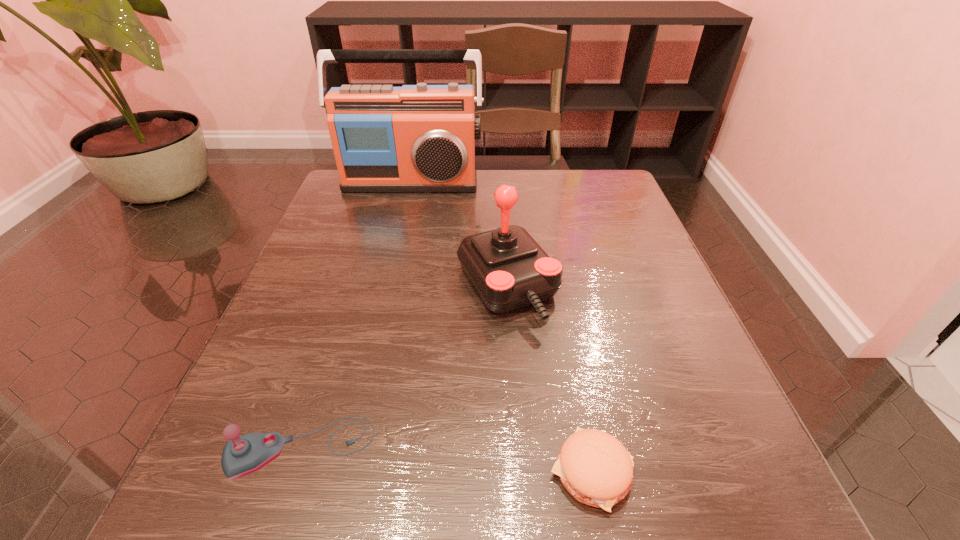
This screenshot has height=540, width=960. In order to click on vacant space positioned 0.150m on the left of the shortest object in this screenshot , I will do `click(431, 471)`.

You are a GUI agent. You are given a task and a screenshot of the screen. Output one action in this format:
    pyautogui.click(x=<x>, y=<y>)
    Task: Click on the object positioned at the far edge
    
    Given the screenshot: What is the action you would take?
    pyautogui.click(x=416, y=138)

Image resolution: width=960 pixels, height=540 pixels. I want to click on joystick at the near edge, so click(x=243, y=455).

Where is `patty that is at the near edge`? This screenshot has height=540, width=960. patty that is at the near edge is located at coordinates (596, 469).

Where is `radio receiver at the left edge`? Image resolution: width=960 pixels, height=540 pixels. radio receiver at the left edge is located at coordinates (416, 138).

Find the location of a particular element. The image size is (960, 540). joystick that is positioned at the left edge is located at coordinates (243, 455).

Find the location of a particular element. The width and height of the screenshot is (960, 540). object present at the right edge is located at coordinates (596, 469).

Where is `object positioned at the far left corner`? object positioned at the far left corner is located at coordinates (416, 138).

At what (x,y) coordinates should I click in order to perform the action: click on object that is at the near left corner. Please return your answer as a coordinate pair (x, y). This screenshot has width=960, height=540. Looking at the image, I should click on (243, 455).

Where is `object that is at the near right corner`? This screenshot has height=540, width=960. object that is at the near right corner is located at coordinates (596, 469).